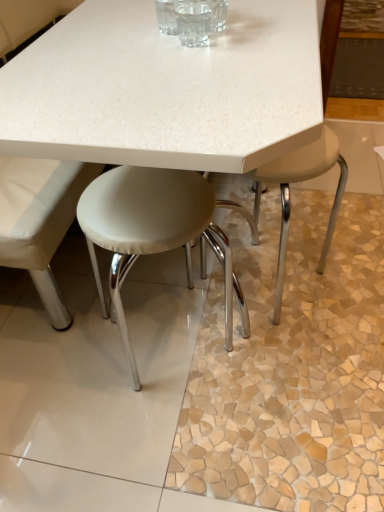
Identify the location of vacant space situated on the left part of white leather stool at center, which is the 1th stool in left-to-right order. (55, 355).